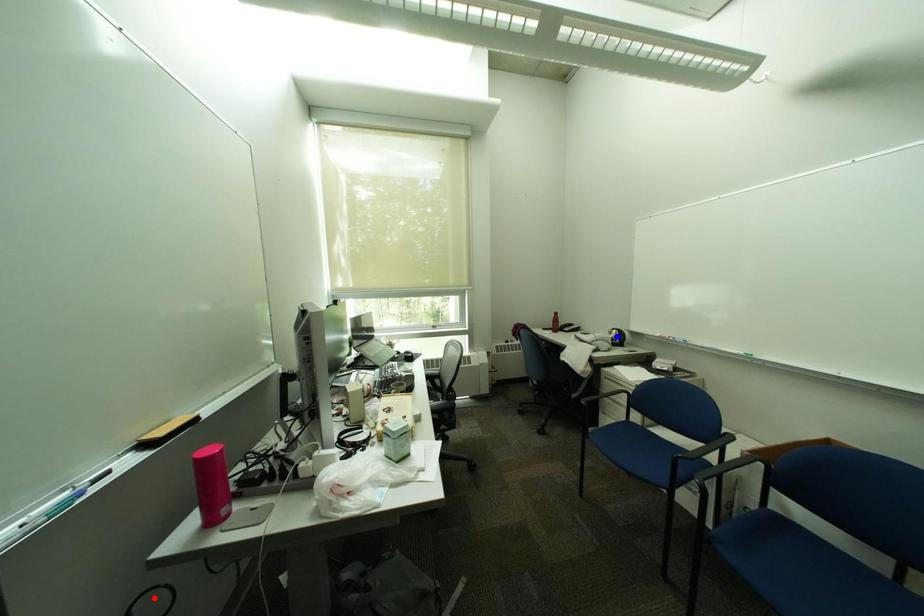
Question: Which of the two points in the image is closer to the camera?

Choices:
 (A) Blue point is closer.
 (B) Red point is closer.

Answer: (B)